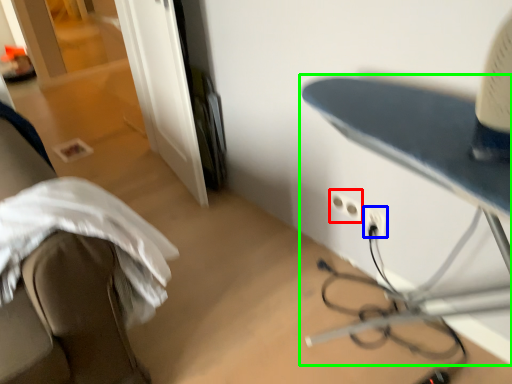
Question: Which is nearer to the electric outlet (highlighted by a red box)? electric outlet (highlighted by a blue box) or table (highlighted by a green box).

Choices:
 (A) electric outlet
 (B) table

Answer: (A)